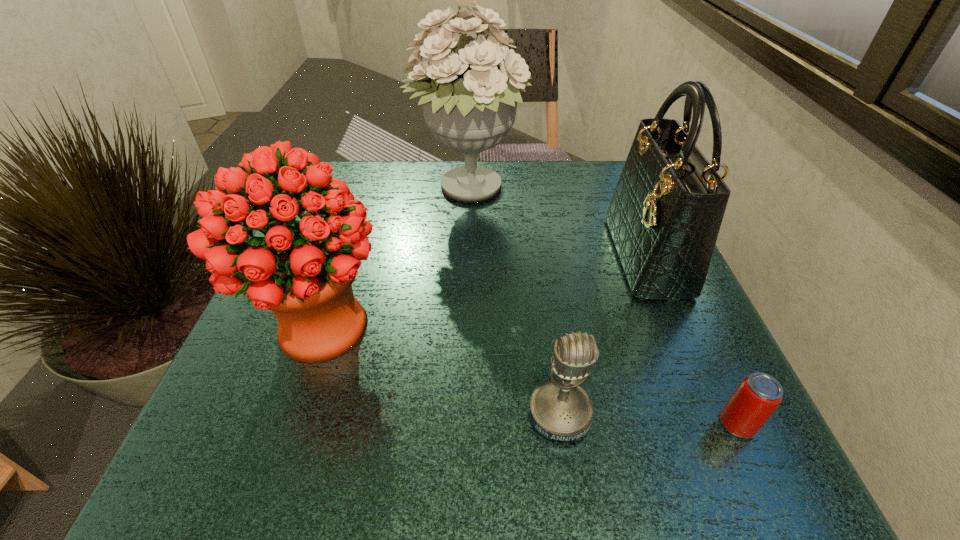
Find the location of a particular element. vacant space that satisfies the following two spatial constraints: 1. on the back side of the farther bouquet; 2. on the right side of the nearer bouquet is located at coordinates (369, 191).

You are a GUI agent. You are given a task and a screenshot of the screen. Output one action in this format:
    pyautogui.click(x=<x>, y=<y>)
    Task: Click on the free location that satisfies the following two spatial constraints: 1. on the front-facing side of the fourth tallest object; 2. on the right side of the shortest object
    The height and width of the screenshot is (540, 960).
    Given the screenshot: What is the action you would take?
    pos(561,424)

Find the location of `free location that satisfies the following two spatial constraints: 1. at the front of the handbag with visible charms; 2. on the front-facing side of the fourth tallest object`. free location that satisfies the following two spatial constraints: 1. at the front of the handbag with visible charms; 2. on the front-facing side of the fourth tallest object is located at coordinates (714, 414).